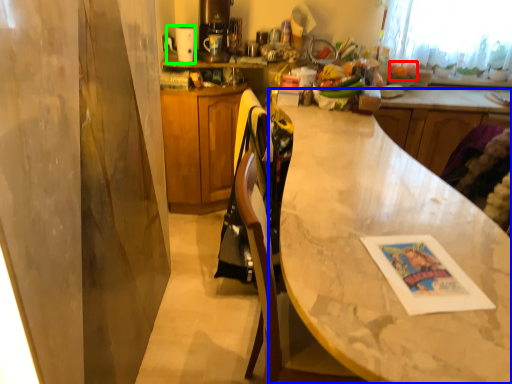
Question: Which is farther away from fruit (highlighted by a red box)? countertop (highlighted by a blue box) or appliance (highlighted by a green box)?

Choices:
 (A) countertop
 (B) appliance

Answer: (A)